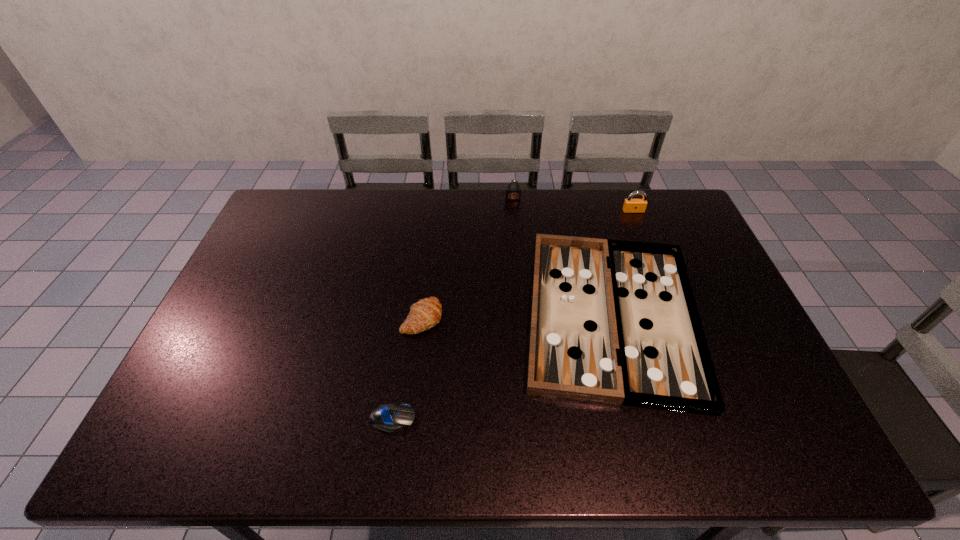
Where is `free space located 0.130m on the left of the gameboard`? free space located 0.130m on the left of the gameboard is located at coordinates (475, 314).

Where is `blank space located 0.130m on the button side of the shortest object`? This screenshot has width=960, height=540. blank space located 0.130m on the button side of the shortest object is located at coordinates (470, 419).

Where is `object located at the near edge`? object located at the near edge is located at coordinates (388, 418).

The image size is (960, 540). Find the location of `padlock located in the right edge section of the desktop`. padlock located in the right edge section of the desktop is located at coordinates (630, 205).

I want to click on gameboard positioned at the right edge, so click(616, 322).

Find the location of `object positioned at the far right corner`. object positioned at the far right corner is located at coordinates (630, 205).

At what (x,y) coordinates should I click in order to perform the action: click on free region at the far edge of the desktop. Please return your answer as a coordinate pair (x, y). Looking at the image, I should click on (529, 209).

Find the location of a particular element. This screenshot has height=540, width=960. free space at the near edge of the desktop is located at coordinates [576, 443].

The width and height of the screenshot is (960, 540). I want to click on free point at the left edge, so click(x=198, y=367).

Image resolution: width=960 pixels, height=540 pixels. Identify the location of vacant position at the right edge of the desktop. (713, 355).